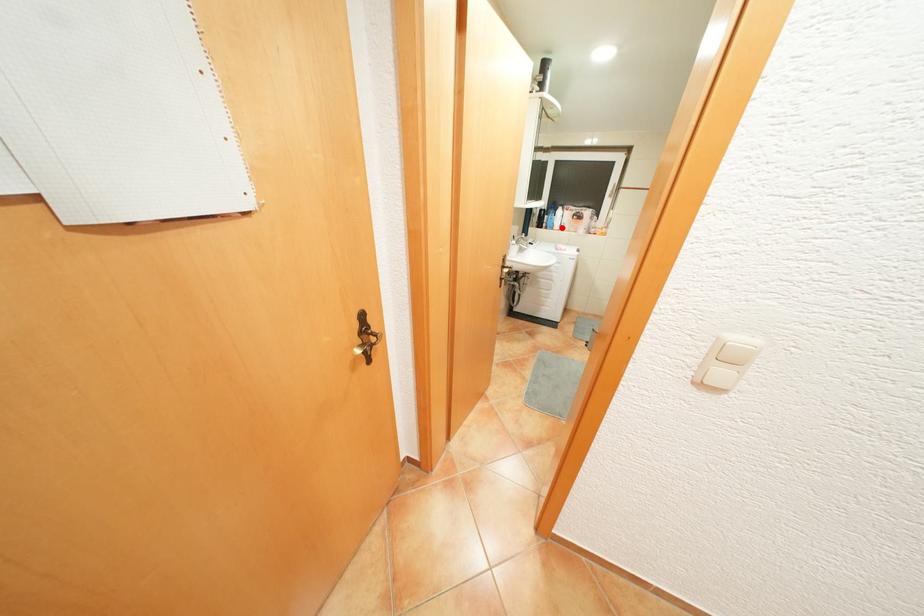
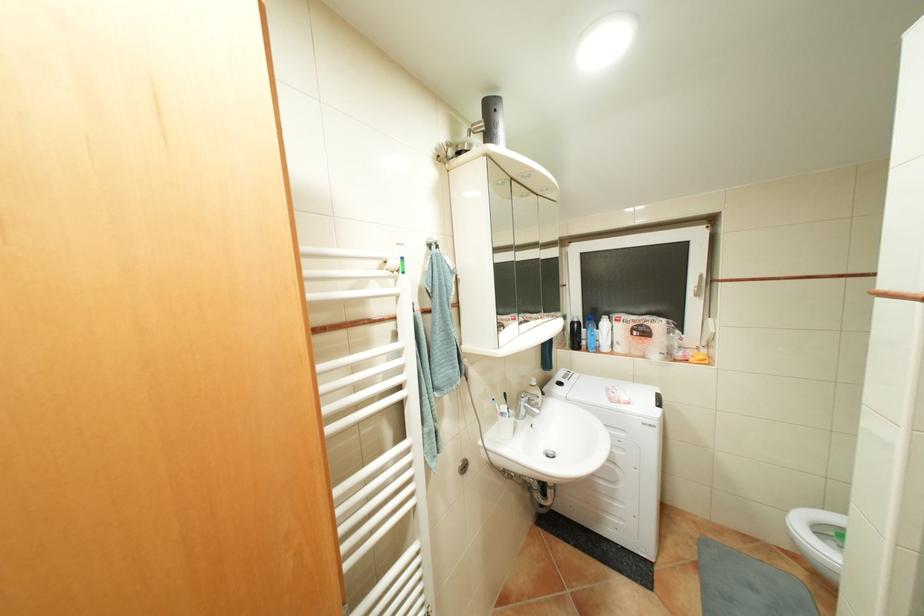
Question: I am providing you with two images of the same scene from different viewpoints. In image1, a red point is highlighted. Considering the same 3D point in image2, which of the following is correct?

Choices:
 (A) It is closer
 (B) It is farther

Answer: (B)